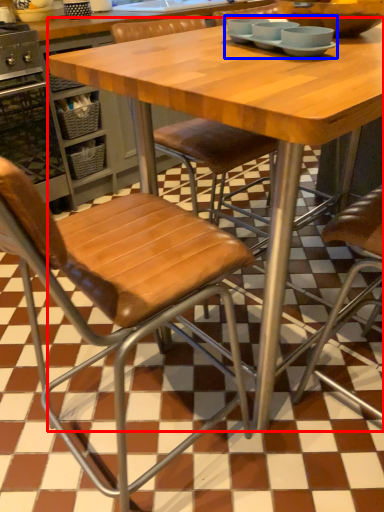
Question: Which point is closer to the camera, table (highlighted by a red box) or tableware (highlighted by a blue box)?

Choices:
 (A) table
 (B) tableware

Answer: (A)